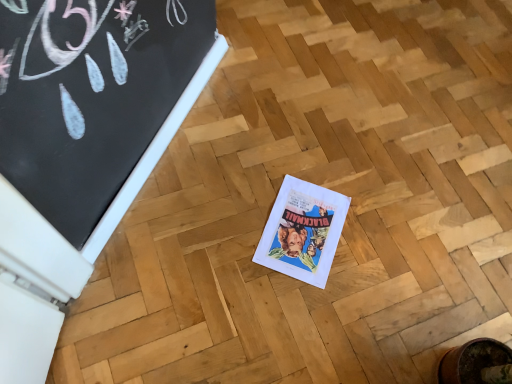
Question: From a real-world perspective, does white paper comic book at center sit lower than black chalkboard at upper left?

Choices:
 (A) yes
 (B) no

Answer: (A)

Question: Does white paper comic book at center have a lesser width compared to black chalkboard at upper left?

Choices:
 (A) yes
 (B) no

Answer: (B)

Question: Could you tell me if white paper comic book at center is turned towards black chalkboard at upper left?

Choices:
 (A) no
 (B) yes

Answer: (A)

Question: Does white paper comic book at center come in front of black chalkboard at upper left?

Choices:
 (A) yes
 (B) no

Answer: (B)

Question: Are white paper comic book at center and black chalkboard at upper left located far from each other?

Choices:
 (A) yes
 (B) no

Answer: (B)

Question: Are white paper comic book at center and black chalkboard at upper left beside each other?

Choices:
 (A) no
 (B) yes

Answer: (A)

Question: Considering the relative sizes of black chalkboard at upper left and white paper comic book at center in the image provided, is black chalkboard at upper left smaller than white paper comic book at center?

Choices:
 (A) yes
 (B) no

Answer: (B)

Question: Does black chalkboard at upper left contain white paper comic book at center?

Choices:
 (A) yes
 (B) no

Answer: (B)

Question: Is black chalkboard at upper left shorter than white paper comic book at center?

Choices:
 (A) yes
 (B) no

Answer: (B)

Question: Are black chalkboard at upper left and white paper comic book at center beside each other?

Choices:
 (A) no
 (B) yes

Answer: (A)

Question: Considering the relative positions of black chalkboard at upper left and white paper comic book at center in the image provided, is black chalkboard at upper left to the left of white paper comic book at center from the viewer's perspective?

Choices:
 (A) yes
 (B) no

Answer: (A)

Question: Is black chalkboard at upper left oriented towards white paper comic book at center?

Choices:
 (A) yes
 (B) no

Answer: (A)

Question: Based on their positions, is white paper comic book at center located to the left or right of black chalkboard at upper left?

Choices:
 (A) left
 (B) right

Answer: (B)